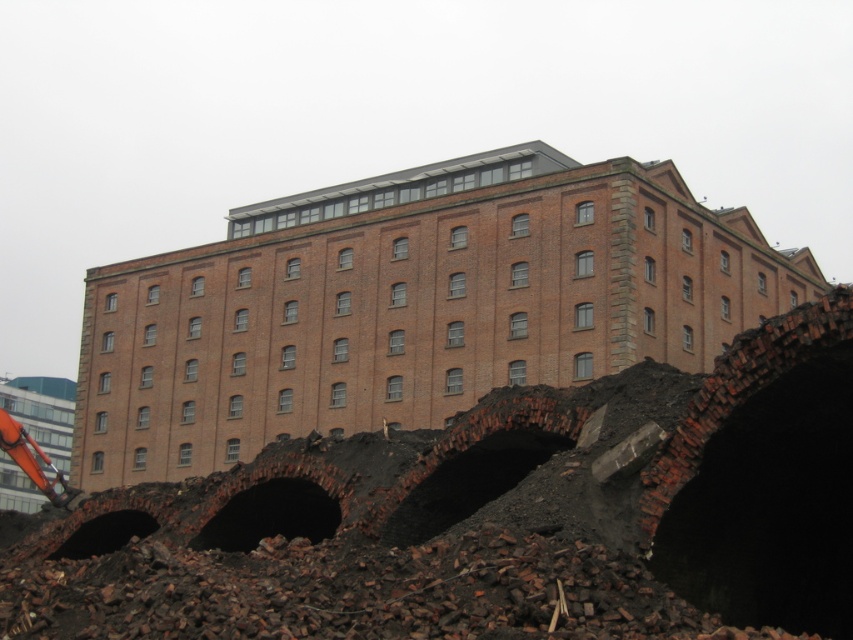
Does exposed brick rubble at center have a lesser width compared to dark brown stone hole at lower left?

No, exposed brick rubble at center is not thinner than dark brown stone hole at lower left.

Who is lower down, exposed brick rubble at center or dark brown stone hole at lower left?

dark brown stone hole at lower left

I want to click on exposed brick rubble at center, so click(410, 305).

Is exposed brick rubble at center below dark brick hole at center?

Incorrect, exposed brick rubble at center is not positioned below dark brick hole at center.

Which is more to the right, exposed brick rubble at center or dark brick hole at center?

exposed brick rubble at center

Where is `exposed brick rubble at center`? This screenshot has width=853, height=640. exposed brick rubble at center is located at coordinates (410, 305).

You are a GUI agent. You are given a task and a screenshot of the screen. Output one action in this format:
    pyautogui.click(x=<x>, y=<y>)
    Task: Click on the dark brick hole at center
    This screenshot has width=853, height=640.
    Given the screenshot: What is the action you would take?
    pyautogui.click(x=270, y=515)

What do you see at coordinates (270, 515) in the screenshot? I see `dark brick hole at center` at bounding box center [270, 515].

I want to click on dark brick hole at center, so click(270, 515).